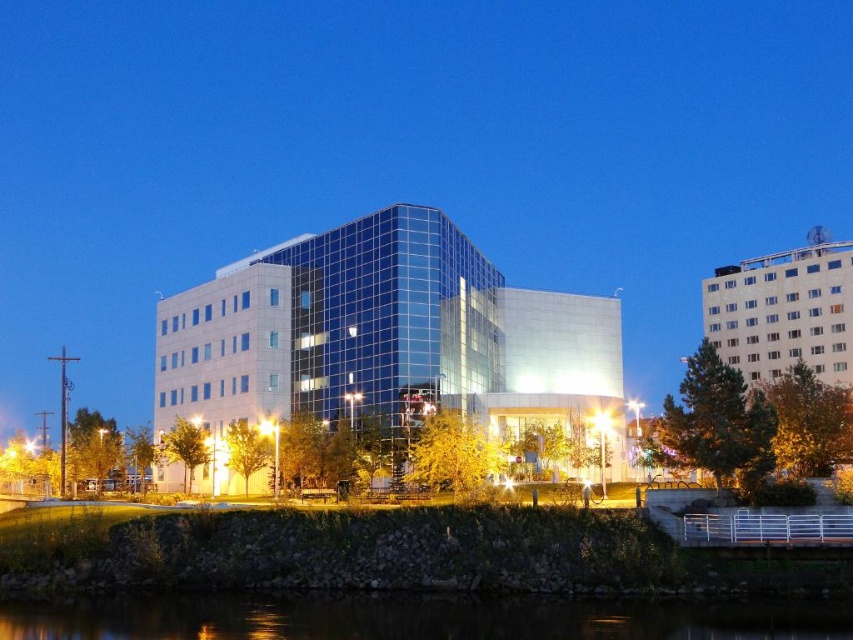
Image resolution: width=853 pixels, height=640 pixels. I want to click on transparent glass water at lower center, so click(421, 618).

The width and height of the screenshot is (853, 640). What do you see at coordinates (421, 618) in the screenshot?
I see `transparent glass water at lower center` at bounding box center [421, 618].

Where is `transparent glass water at lower center`? transparent glass water at lower center is located at coordinates (421, 618).

Does glassy blue building at center lie in front of transparent glass water at lower center?

No, it is not.

Is glassy blue building at center shorter than transparent glass water at lower center?

Incorrect, glassy blue building at center's height does not fall short of transparent glass water at lower center's.

The height and width of the screenshot is (640, 853). Describe the element at coordinates (386, 337) in the screenshot. I see `glassy blue building at center` at that location.

Locate an element on the screen. This screenshot has height=640, width=853. glassy blue building at center is located at coordinates (386, 337).

Who is more distant from viewer, (229, 268) or (782, 358)?

Point (782, 358)

Is glassy blue building at center positioned before white textured building at upper right?

No, it is behind white textured building at upper right.

The image size is (853, 640). I want to click on glassy blue building at center, so click(386, 337).